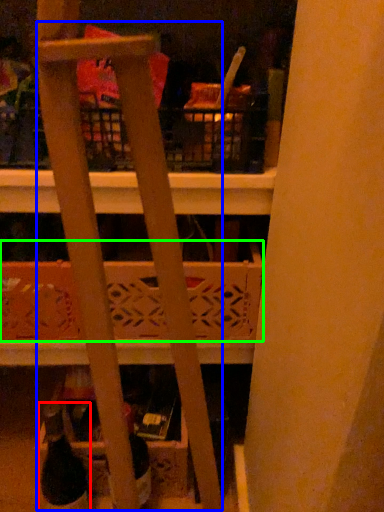
Question: Which object is the closest to the wine bottle (highlighted by a red box)? Choose among these: ladder (highlighted by a blue box) or basket (highlighted by a green box).

Choices:
 (A) ladder
 (B) basket

Answer: (B)